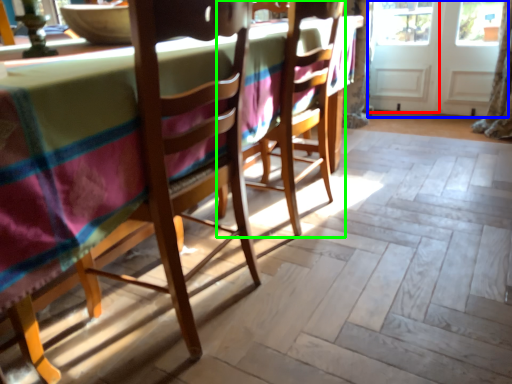
Question: Which is farther away from screen door (highlighted by a red box)? screen door (highlighted by a blue box) or chair (highlighted by a green box)?

Choices:
 (A) screen door
 (B) chair

Answer: (B)